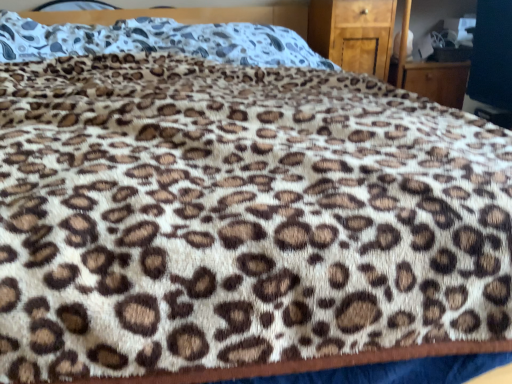
You are a GUI agent. You are given a task and a screenshot of the screen. Output one action in this format:
    pyautogui.click(x=<x>, y=<y>)
    Task: Click on the wooden dresser at upper right
    This screenshot has height=384, width=512.
    Given the screenshot: What is the action you would take?
    click(x=353, y=33)

Describe the element at coordinates (353, 33) in the screenshot. I see `wooden dresser at upper right` at that location.

This screenshot has height=384, width=512. I want to click on wooden dresser at upper right, so click(353, 33).